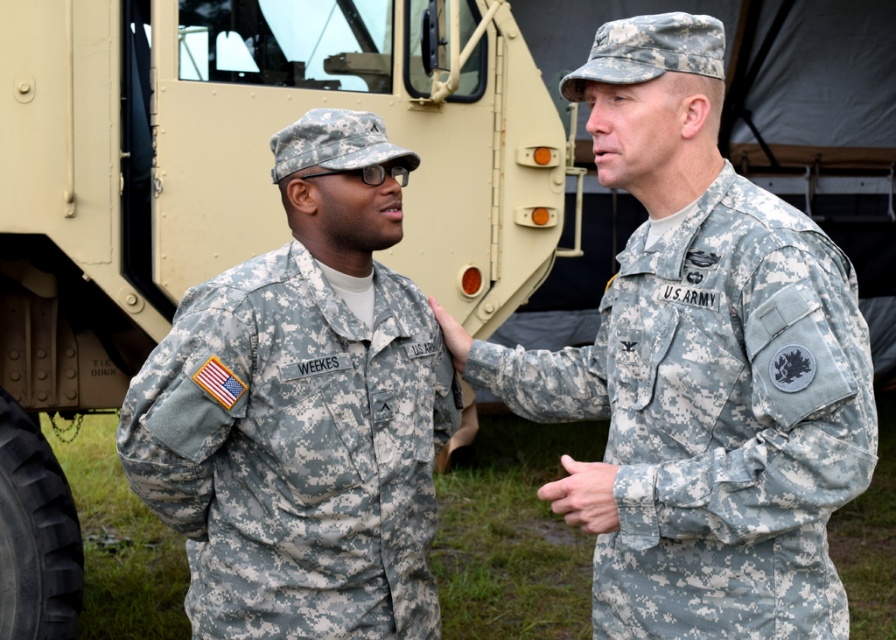
You are a photographer positioned at the center of the scene. You want to capture a photo that includes both the two soldiers and the tan matte truck at upper left. Based on their positions, will the truck be visible in the frame if you focus on the soldiers?

The tan matte truck at upper left is located at point (224, 198), which means it is positioned at the upper left corner of the scene. Since the soldiers are standing in the center area, the truck may be partially visible at the edge of the frame if the camera angle includes the upper left area. However, without adjusting the camera angle to include that corner, the truck might not be fully visible. To ensure both are in the frame, you should position the camera to include the upper left quadrant while the

You are a photographer setting up for a group photo. You have to position the tan matte truck at upper left and the camouflage fabric us army uniform at right in the frame. Which object should you place closer to the center of the image to ensure both fit within the frame?

The tan matte truck at upper left is wider than the camouflage fabric us army uniform at right. To ensure both fit within the frame, you should position the tan matte truck at upper left closer to the center so its wider width can be accommodated without exceeding the frame boundaries.

You are a photographer trying to capture a closeup of the camouflage fabric us army uniform at right. Based on the coordinates provided, where should you position your camera relative to the image frame?

The camouflage fabric us army uniform at right is located at coordinates point (716, 420), so you should position your camera to focus on that point to capture the closeup.